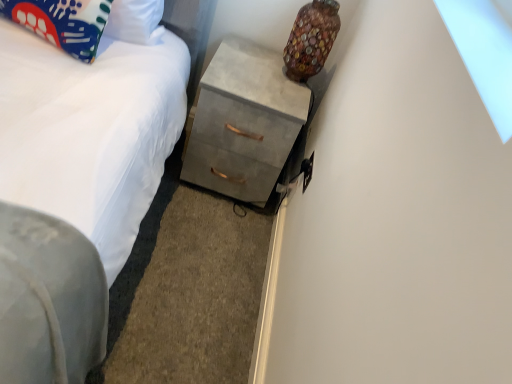
Identify the location of vacant area that lies in front of concrete gray chest of drawers at center. (201, 229).